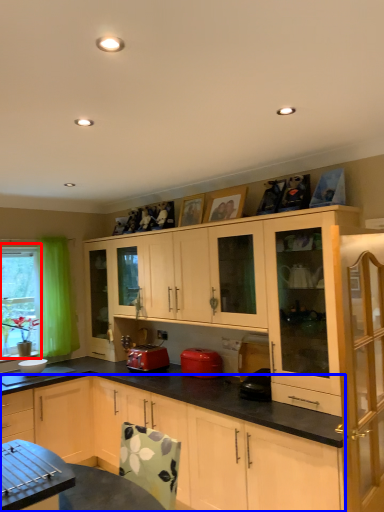
Question: Which object appears farthest to the camera in this image, bay window (highlighted by a red box) or cabinetry (highlighted by a blue box)?

Choices:
 (A) bay window
 (B) cabinetry

Answer: (A)